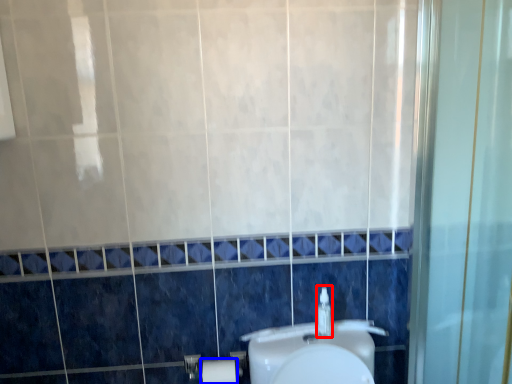
Question: Which of the following is the closest to the observer, soap dispenser (highlighted by a red box) or toilet paper (highlighted by a blue box)?

Choices:
 (A) soap dispenser
 (B) toilet paper

Answer: (A)